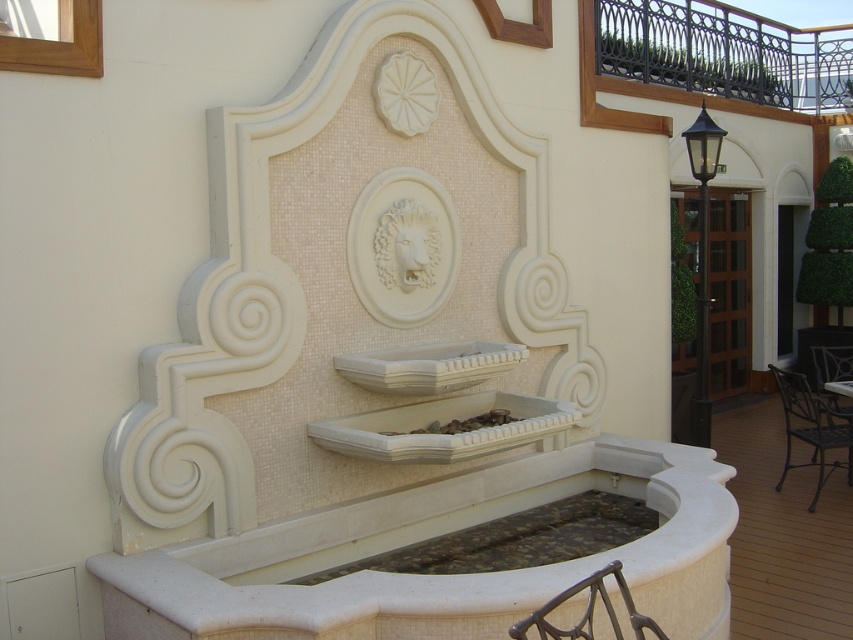
Does metallic dark brown chair at right have a lesser height compared to metallic wrought iron chair at lower center?

No.

Is metallic dark brown chair at right smaller than metallic wrought iron chair at lower center?

No.

Locate an element on the screen. Image resolution: width=853 pixels, height=640 pixels. metallic dark brown chair at right is located at coordinates (811, 428).

Image resolution: width=853 pixels, height=640 pixels. I want to click on metallic dark brown chair at right, so click(811, 428).

Does point (596, 588) come in front of point (825, 355)?

Yes, it is.

Who is more forward, (601, 576) or (851, 376)?

Positioned in front is point (601, 576).

You are a GUI agent. You are given a task and a screenshot of the screen. Output one action in this format:
    pyautogui.click(x=<x>, y=<y>)
    Task: Click on the metallic wrought iron chair at lower center
    The height and width of the screenshot is (640, 853).
    Given the screenshot: What is the action you would take?
    pyautogui.click(x=587, y=611)

How distant is metallic dark brown chair at right from metallic dark gray chair at right?

The distance of metallic dark brown chair at right from metallic dark gray chair at right is 27.73 inches.

Can you confirm if metallic dark brown chair at right is smaller than metallic dark gray chair at right?

Incorrect, metallic dark brown chair at right is not smaller in size than metallic dark gray chair at right.

At what (x,y) coordinates should I click in order to perform the action: click on metallic dark brown chair at right. Please return your answer as a coordinate pair (x, y). The image size is (853, 640). Looking at the image, I should click on pyautogui.click(x=811, y=428).

I want to click on metallic dark brown chair at right, so click(811, 428).